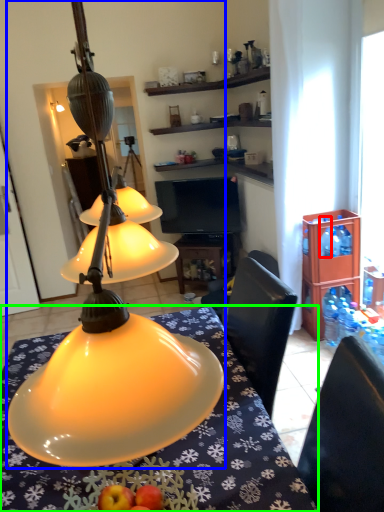
Question: Based on their relative distances, which object is nearer to bottle (highlighted by a red box)? Choose from lamp (highlighted by a blue box) and desk (highlighted by a green box).

Choices:
 (A) lamp
 (B) desk

Answer: (B)